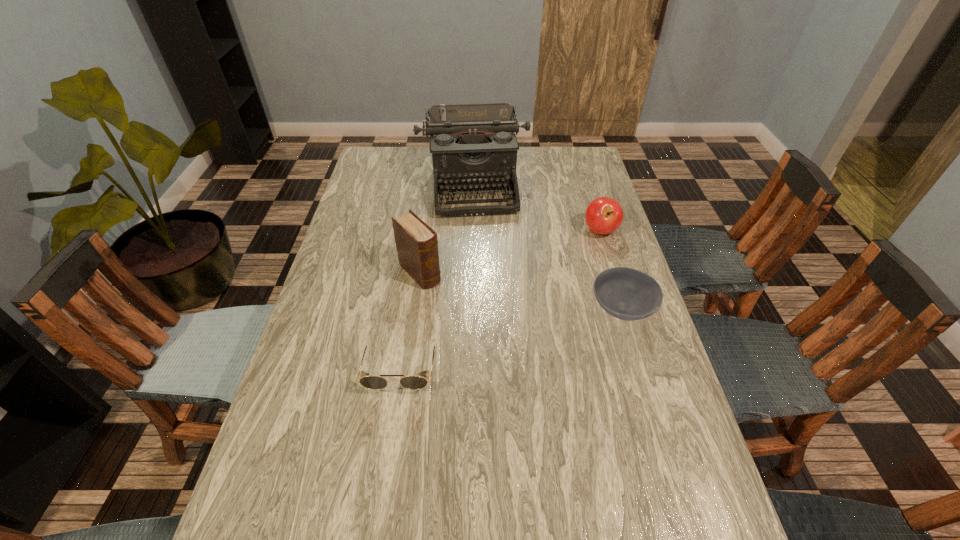
At what (x,y) coordinates should I click in order to perform the action: click on the nearest object. Please return your answer as a coordinate pair (x, y). The height and width of the screenshot is (540, 960). Looking at the image, I should click on (375, 382).

Where is `bowl`? bowl is located at coordinates (625, 293).

Where is `the second tallest object`? the second tallest object is located at coordinates (416, 243).

Image resolution: width=960 pixels, height=540 pixels. I want to click on the tallest object, so click(473, 145).

This screenshot has height=540, width=960. Find the location of `apple`. apple is located at coordinates (604, 215).

At what (x,y) coordinates should I click in order to perform the action: click on vacant point located 0.200m on the front lenses of the nearest object. Please return your answer as a coordinate pair (x, y). The width and height of the screenshot is (960, 540). Looking at the image, I should click on (383, 484).

The height and width of the screenshot is (540, 960). Find the location of `vacant region located on the front of the bowl`. vacant region located on the front of the bowl is located at coordinates (679, 498).

Where is `free spot located on the spine side of the diary`? This screenshot has width=960, height=540. free spot located on the spine side of the diary is located at coordinates (443, 297).

Identify the location of vacant region located 0.300m on the spine side of the diary. (499, 354).

Find the location of a particular element. This screenshot has width=960, height=540. vacant region located on the spine side of the diary is located at coordinates (499, 354).